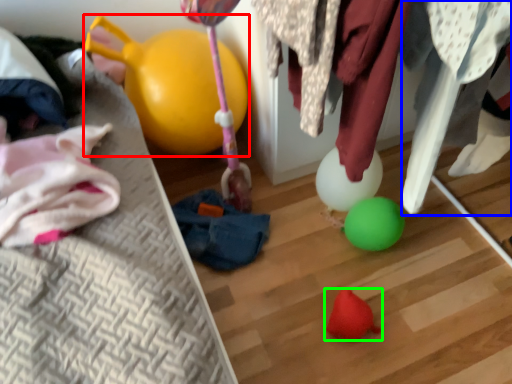
Question: Considering the real-world distances, which object is closest to balloon (highlighted by a red box)? clothing (highlighted by a blue box) or toy (highlighted by a green box).

Choices:
 (A) clothing
 (B) toy

Answer: (A)